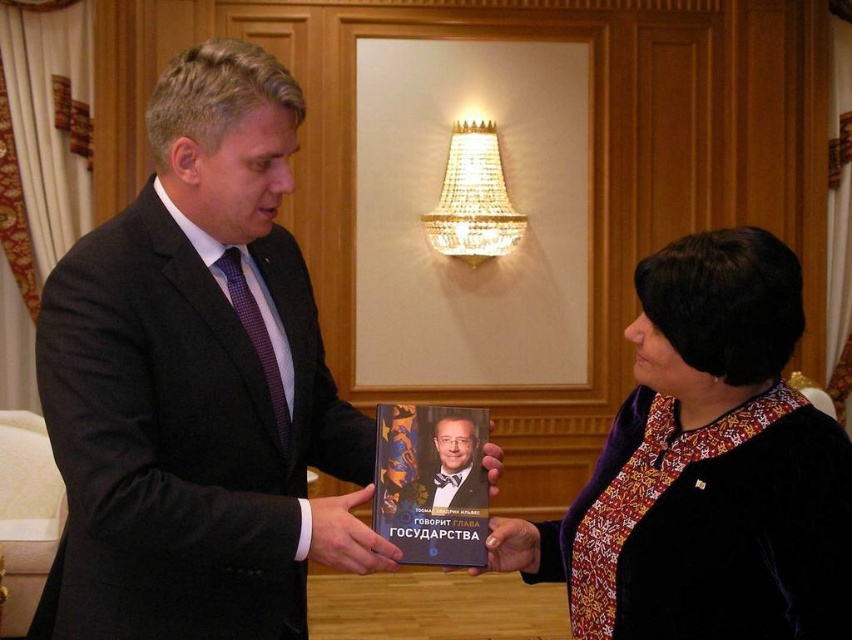
Question: Considering the relative positions of smooth black hand at center and matte black book at center in the image provided, where is smooth black hand at center located with respect to matte black book at center?

Choices:
 (A) above
 (B) below

Answer: (A)

Question: Is velvet black dress at center bigger than smooth black bow tie at center?

Choices:
 (A) yes
 (B) no

Answer: (A)

Question: Can you confirm if smooth black hand at center is positioned above matte black book at center?

Choices:
 (A) yes
 (B) no

Answer: (A)

Question: Which point is closer to the camera?

Choices:
 (A) (429, 556)
 (B) (332, 545)

Answer: (B)

Question: Which is nearer to the velvet black dress at center?

Choices:
 (A) dark gray wool suit at left
 (B) hardcover book at center
 (C) smooth black bow tie at center

Answer: (B)

Question: Which of the following is the farthest from the observer?

Choices:
 (A) (44, 328)
 (B) (470, 502)
 (C) (527, 538)

Answer: (C)